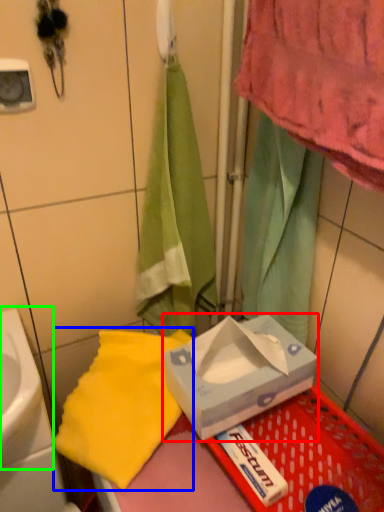
Question: Which is nearer to the box (highlighted by a red box)? beach towel (highlighted by a blue box) or sink (highlighted by a green box).

Choices:
 (A) beach towel
 (B) sink

Answer: (A)